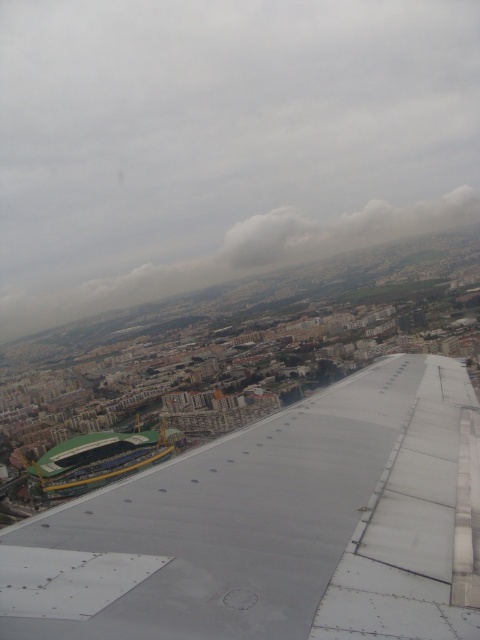
You are a pilot flying an aircraft and notice a white fluffy cloud at upper center and a green plastic stadium at lower left. Can you safely descend the plane to a lower altitude without hitting either object?

The distance between the white fluffy cloud at upper center and the green plastic stadium at lower left is 436.79 meters. Since clouds are above the aircraft and the stadium is on the ground, descending to a lower altitude would not interfere with either object as long as standard aviation safety protocols are followed.